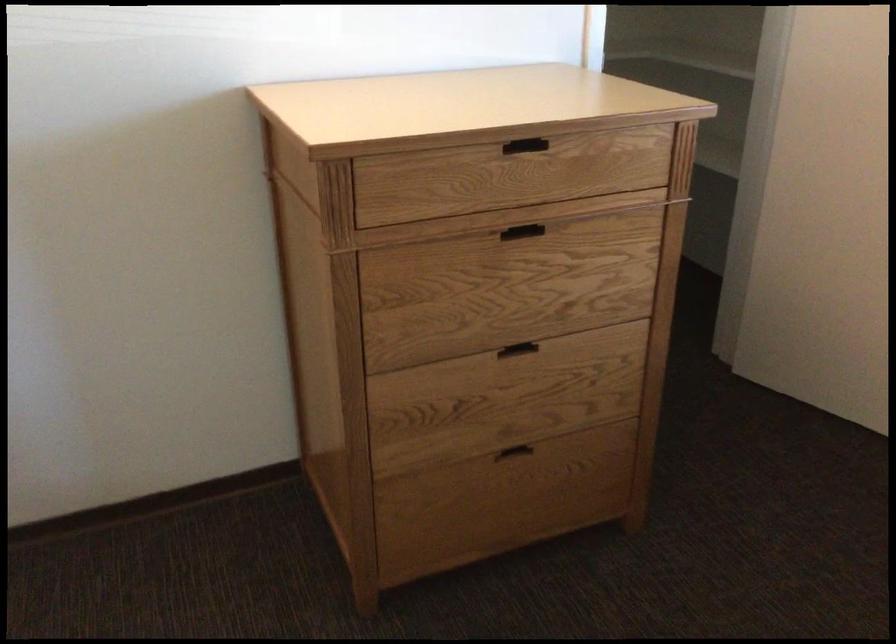
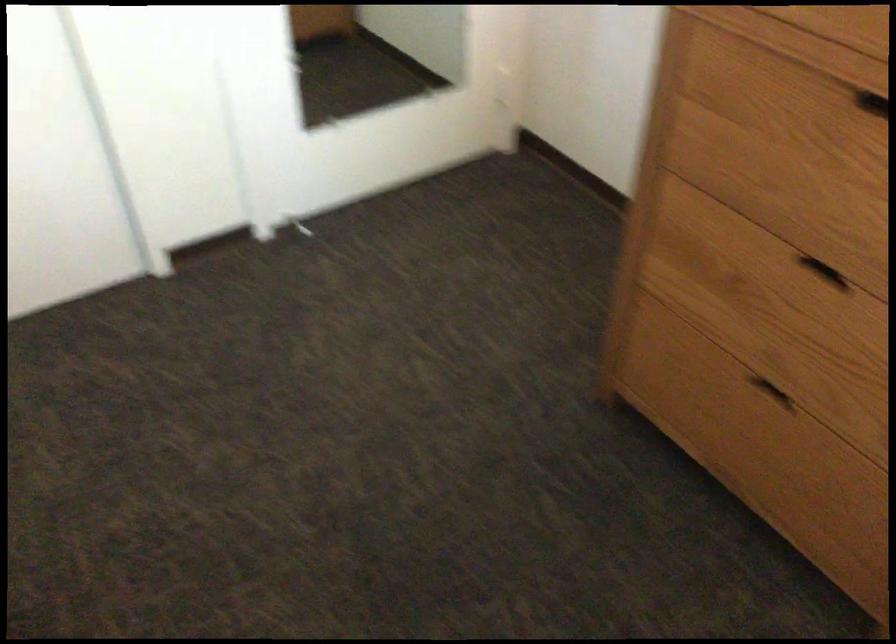
Find the pixel in the second image that matches point (504, 351) in the first image.

(824, 272)